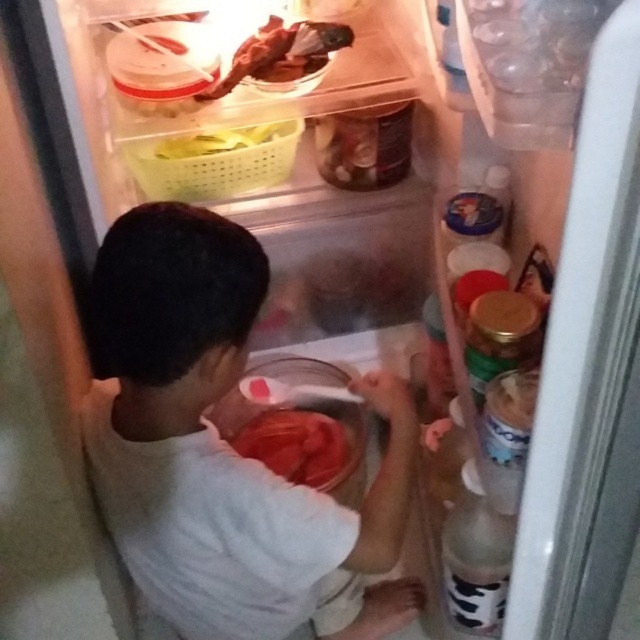
Does white cotton shirt at center have a smaller size compared to yellow plastic basket at upper left?

Incorrect, white cotton shirt at center is not smaller in size than yellow plastic basket at upper left.

Locate an element on the screen. This screenshot has height=640, width=640. white cotton shirt at center is located at coordinates (225, 449).

This screenshot has height=640, width=640. Identify the location of white cotton shirt at center. (225, 449).

Is shiny red meat at center thinner than yellow plastic basket at upper left?

Indeed, shiny red meat at center has a lesser width compared to yellow plastic basket at upper left.

Does shiny red meat at center appear under yellow plastic basket at upper left?

Yes, shiny red meat at center is below yellow plastic basket at upper left.

I want to click on shiny red meat at center, so click(296, 445).

What are the coordinates of `shiny red meat at center` in the screenshot? It's located at (296, 445).

Does shiny brown meat at upper left have a greater width compared to yellow plastic basket at upper left?

Yes, shiny brown meat at upper left is wider than yellow plastic basket at upper left.

Is shiny brown meat at upper left below yellow plastic basket at upper left?

Incorrect, shiny brown meat at upper left is not positioned below yellow plastic basket at upper left.

From the picture: Who is more forward, (262, 76) or (180, 148)?

Positioned in front is point (262, 76).

Where is `shiny brown meat at upper left`? This screenshot has width=640, height=640. shiny brown meat at upper left is located at coordinates (282, 52).